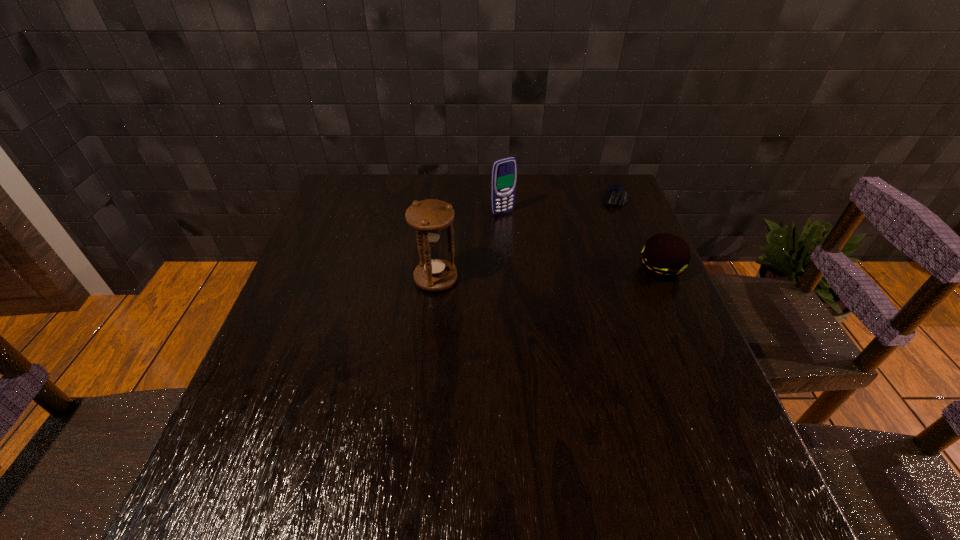
Where is `free space between the third shortest object and the third tallest object`? free space between the third shortest object and the third tallest object is located at coordinates (581, 241).

At what (x,y) coordinates should I click in order to perform the action: click on free space between the computer mouse and the leftmost object. Please return your answer as a coordinate pair (x, y). This screenshot has height=540, width=960. Looking at the image, I should click on (525, 239).

The width and height of the screenshot is (960, 540). I want to click on vacant point located between the shortest object and the cellular telephone, so pos(559,206).

The width and height of the screenshot is (960, 540). Identify the location of free area in between the shortest object and the tallest object. (525, 239).

Locate an element on the screen. The image size is (960, 540). free space that is in between the hourglass and the computer mouse is located at coordinates (525, 239).

Where is `empty space between the third object from right to left and the shortest object`? The width and height of the screenshot is (960, 540). empty space between the third object from right to left and the shortest object is located at coordinates (559, 206).

Find the location of a particular element. This screenshot has height=540, width=960. object identified as the third closest to the second farthest object is located at coordinates (664, 257).

Identify which object is the closest to the third object from right to left. Please provide its 2D coordinates. Your answer should be formatted as a tuple, i.e. [(x, y)], where the tuple contains the x and y coordinates of a point satisfying the conditions above.

[(429, 218)]

The width and height of the screenshot is (960, 540). I want to click on free space that satisfies the following two spatial constraints: 1. on the front side of the patty; 2. on the right side of the computer mouse, so click(643, 269).

Identify the location of free location that satisfies the following two spatial constraints: 1. on the back side of the third object from right to left; 2. on the right side of the leftmost object. (443, 213).